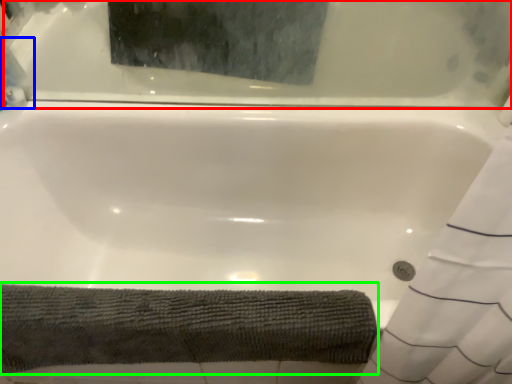
Question: Which is nearer to the bathtub (highlighted by a red box)? cleaning product (highlighted by a blue box) or bath towel (highlighted by a green box).

Choices:
 (A) cleaning product
 (B) bath towel

Answer: (A)